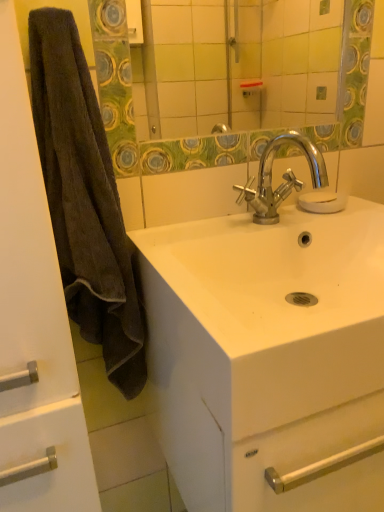
Find the location of `free space to the left of transparent glass soap at center`. free space to the left of transparent glass soap at center is located at coordinates (264, 213).